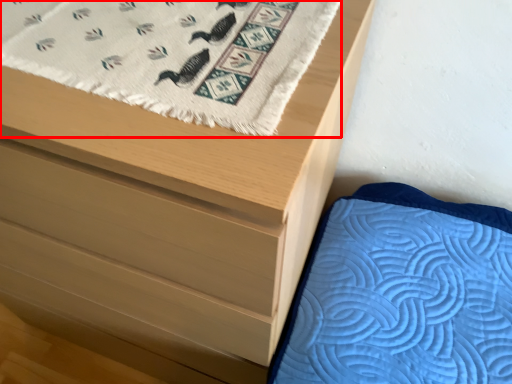
Question: From the image's perspective, what is the correct spatial relationship of blanket (annotated by the red box) in relation to chest of drawers?

Choices:
 (A) below
 (B) above

Answer: (B)